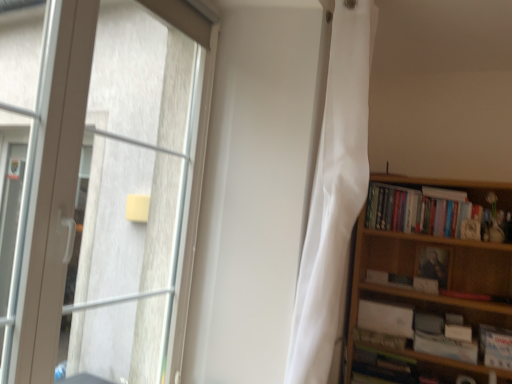
This screenshot has height=384, width=512. What do you see at coordinates (496, 347) in the screenshot?
I see `white paper book at right, marked as the second book in a bottom-to-top arrangement` at bounding box center [496, 347].

Image resolution: width=512 pixels, height=384 pixels. Identify the location of hardcover books at right, the first book when ordered from top to bottom. (423, 213).

This screenshot has width=512, height=384. Describe the element at coordinates (416, 275) in the screenshot. I see `wooden bookcase at right` at that location.

What are the coordinates of `white paper book at right, marked as the second book in a bottom-to-top arrangement` in the screenshot? It's located at (496, 347).

Considering the relative positions of white matte paperback book at lower right, which appears as the first paperback book when ordered from the bottom, and hardcover book at lower right, the fifth book from the top, in the image provided, is white matte paperback book at lower right, which appears as the first paperback book when ordered from the bottom, to the right of hardcover book at lower right, the fifth book from the top, from the viewer's perspective?

Indeed, white matte paperback book at lower right, which appears as the first paperback book when ordered from the bottom, is positioned on the right side of hardcover book at lower right, the fifth book from the top.

Is white matte paperback book at lower right, placed as the 2th paperback book when sorted from top to bottom, positioned far away from hardcover book at lower right, acting as the first book starting from the bottom?

Actually, white matte paperback book at lower right, placed as the 2th paperback book when sorted from top to bottom, and hardcover book at lower right, acting as the first book starting from the bottom, are a little close together.

Considering the sizes of objects white matte paperback book at lower right, which appears as the first paperback book when ordered from the bottom, and hardcover book at lower right, acting as the first book starting from the bottom, in the image provided, who is smaller, white matte paperback book at lower right, which appears as the first paperback book when ordered from the bottom, or hardcover book at lower right, acting as the first book starting from the bottom,?

white matte paperback book at lower right, which appears as the first paperback book when ordered from the bottom.

Could you measure the distance between white matte book at lower right, arranged as the third book when viewed from the top, and white matte book at right, which appears as the fourth book when ordered from the bottom?

white matte book at lower right, arranged as the third book when viewed from the top, is 8.59 inches from white matte book at right, which appears as the fourth book when ordered from the bottom.

How different are the orientations of white matte book at lower right, which ranks as the third book in bottom-to-top order, and white matte book at right, acting as the 2th book starting from the top, in degrees?

6.4 degrees.

Consider the image. Considering the relative sizes of white matte book at lower right, which ranks as the third book in bottom-to-top order, and white matte book at right, which appears as the fourth book when ordered from the bottom, in the image provided, is white matte book at lower right, which ranks as the third book in bottom-to-top order, thinner than white matte book at right, which appears as the fourth book when ordered from the bottom,?

No.

Would you say white matte book at lower right, which ranks as the third book in bottom-to-top order, is inside or outside white matte book at right, which appears as the fourth book when ordered from the bottom?

white matte book at lower right, which ranks as the third book in bottom-to-top order, is outside white matte book at right, which appears as the fourth book when ordered from the bottom.

Does white silky curtain at center turn towards white matte book at lower right, arranged as the third book when viewed from the top?

No, white silky curtain at center is not aimed at white matte book at lower right, arranged as the third book when viewed from the top.

From a real-world perspective, is white silky curtain at center on white matte book at lower right, arranged as the third book when viewed from the top?

Yes, from a real-world perspective, white silky curtain at center is above white matte book at lower right, arranged as the third book when viewed from the top.

Considering their positions, is transparent glass window at left located in front of or behind white silky curtain at center?

Visually, transparent glass window at left is located in front of white silky curtain at center.

How many degrees apart are the facing directions of transparent glass window at left and white silky curtain at center?

They differ by 1.04 degrees in their facing directions.

From a real-world perspective, which is physically below, transparent glass window at left or white silky curtain at center?

In real-world perspective, transparent glass window at left is lower.

Is white silky curtain at center a part of transparent glass window at left?

No, white silky curtain at center is not surrounded by transparent glass window at left.

Which object is positioned more to the left, white silky curtain at center or matte black portrait at upper right, the second paperback book positioned from the bottom?

From the viewer's perspective, white silky curtain at center appears more on the left side.

From the image's perspective, is white silky curtain at center located beneath matte black portrait at upper right, which is the 1th paperback book from top to bottom?

No.

Is point (327, 226) positioned after point (428, 263)?

No, (327, 226) is in front of (428, 263).

Which is correct: white silky curtain at center is inside matte black portrait at upper right, the second paperback book positioned from the bottom, or outside of it?

white silky curtain at center is spatially situated outside matte black portrait at upper right, the second paperback book positioned from the bottom.

From the image's perspective, would you say white paper book at right, the 4th book viewed from the top, is positioned over white matte book at right, acting as the 2th book starting from the top?

No.

Looking at this image, is white paper book at right, the 4th book viewed from the top, inside or outside of white matte book at right, acting as the 2th book starting from the top?

white paper book at right, the 4th book viewed from the top, is not enclosed by white matte book at right, acting as the 2th book starting from the top.

Considering the positions of points (507, 336) and (407, 285), is point (507, 336) farther from camera compared to point (407, 285)?

That is False.

From a real-world perspective, does white paper book at right, the 4th book viewed from the top, sit lower than white matte book at right, which appears as the fourth book when ordered from the bottom?

Yes, from a real-world perspective, white paper book at right, the 4th book viewed from the top, is beneath white matte book at right, which appears as the fourth book when ordered from the bottom.

Can you tell me how much transparent glass window at left and white matte paperback book at lower right, placed as the 2th paperback book when sorted from top to bottom, differ in facing direction?

89.1 degrees separate the facing orientations of transparent glass window at left and white matte paperback book at lower right, placed as the 2th paperback book when sorted from top to bottom.

Who is more distant, transparent glass window at left or white matte paperback book at lower right, which appears as the first paperback book when ordered from the bottom?

white matte paperback book at lower right, which appears as the first paperback book when ordered from the bottom, is further away from the camera.

Considering the positions of objects transparent glass window at left and white matte paperback book at lower right, which appears as the first paperback book when ordered from the bottom, in the image provided, who is more to the right, transparent glass window at left or white matte paperback book at lower right, which appears as the first paperback book when ordered from the bottom,?

white matte paperback book at lower right, which appears as the first paperback book when ordered from the bottom.

Considering the relative sizes of transparent glass window at left and white matte paperback book at lower right, placed as the 2th paperback book when sorted from top to bottom, in the image provided, is transparent glass window at left smaller than white matte paperback book at lower right, placed as the 2th paperback book when sorted from top to bottom,?

Incorrect, transparent glass window at left is not smaller in size than white matte paperback book at lower right, placed as the 2th paperback book when sorted from top to bottom.

This screenshot has height=384, width=512. Identify the location of book below the white matte paperback book at lower right, which appears as the first paperback book when ordered from the bottom (from the image's perspective). (384, 365).

Which book is the 1st one when counting from the left side of the white matte book at right, which appears as the fourth book when ordered from the bottom? Please provide its 2D coordinates.

[(385, 318)]

From the image, which object appears to be farther from transparent glass window at left, white matte book at lower right, which ranks as the third book in bottom-to-top order, or white paper book at right, marked as the second book in a bottom-to-top arrangement?

The object further to transparent glass window at left is white paper book at right, marked as the second book in a bottom-to-top arrangement.

From the picture: Based on their spatial positions, is matte black portrait at upper right, which is the 1th paperback book from top to bottom, or white paper book at right, marked as the second book in a bottom-to-top arrangement, further from white matte paperback book at lower right, placed as the 2th paperback book when sorted from top to bottom?

matte black portrait at upper right, which is the 1th paperback book from top to bottom.

In the scene shown: From the image, which object appears to be nearer to white silky curtain at center, white matte paperback book at lower right, which appears as the first paperback book when ordered from the bottom, or white matte book at right, acting as the 2th book starting from the top?

Based on the image, white matte paperback book at lower right, which appears as the first paperback book when ordered from the bottom, appears to be nearer to white silky curtain at center.

Which object lies further to the anchor point white matte paperback book at lower right, placed as the 2th paperback book when sorted from top to bottom, white matte book at right, acting as the 2th book starting from the top, or white paper book at right, marked as the second book in a bottom-to-top arrangement?

white matte book at right, acting as the 2th book starting from the top, is further to white matte paperback book at lower right, placed as the 2th paperback book when sorted from top to bottom.

From the image, which object appears to be farther from wooden bookcase at right, transparent glass window at left or white paper book at right, the 4th book viewed from the top?

Among the two, transparent glass window at left is located further to wooden bookcase at right.

From the image, which object appears to be nearer to matte black portrait at upper right, which is the 1th paperback book from top to bottom, hardcover book at lower right, the fifth book from the top, or hardcover books at right, positioned as the fifth book in bottom-to-top order?

hardcover books at right, positioned as the fifth book in bottom-to-top order, is positioned closer to the anchor matte black portrait at upper right, which is the 1th paperback book from top to bottom.

Estimate the real-world distances between objects in this image. Which object is closer to transparent glass window at left, white matte book at right, acting as the 2th book starting from the top, or wooden bookcase at right?

wooden bookcase at right.

Based on their spatial positions, is white silky curtain at center or white matte paperback book at lower right, which appears as the first paperback book when ordered from the bottom, further from matte black portrait at upper right, the second paperback book positioned from the bottom?

Among the two, white silky curtain at center is located further to matte black portrait at upper right, the second paperback book positioned from the bottom.

Where is `paperback book that lies between hardcover books at right, positioned as the fifth book in bottom-to-top order, and white matte book at lower right, which ranks as the third book in bottom-to-top order, from top to bottom`? This screenshot has width=512, height=384. paperback book that lies between hardcover books at right, positioned as the fifth book in bottom-to-top order, and white matte book at lower right, which ranks as the third book in bottom-to-top order, from top to bottom is located at coordinates (434, 265).

You are a GUI agent. You are given a task and a screenshot of the screen. Output one action in this format:
    pyautogui.click(x=<x>, y=<y>)
    Task: Click on the paperback book between matte black portrait at upper right, which is the 1th paperback book from top to bottom, and hardcover book at lower right, the fifth book from the top, in the vertical direction
    
    Given the screenshot: What is the action you would take?
    pyautogui.click(x=445, y=347)

Where is `bookcase between white silky curtain at center and matte black portrait at upper right, which is the 1th paperback book from top to bottom, from front to back`? bookcase between white silky curtain at center and matte black portrait at upper right, which is the 1th paperback book from top to bottom, from front to back is located at coordinates (416, 275).

Image resolution: width=512 pixels, height=384 pixels. In order to click on paperback book between white matte book at right, acting as the 2th book starting from the top, and hardcover book at lower right, acting as the first book starting from the bottom, vertically in this screenshot , I will do pyautogui.click(x=445, y=347).